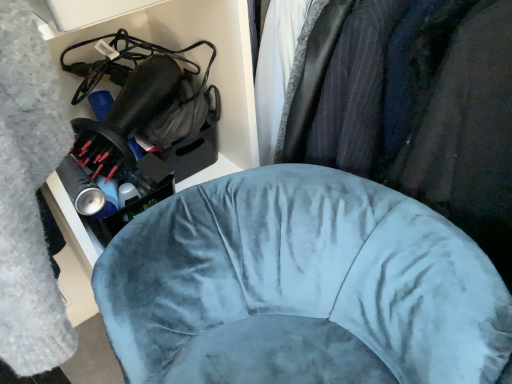
At what (x,y) coordinates should I click in order to perform the action: click on velvet blue chair at center. Please return your answer as a coordinate pair (x, y). Looking at the image, I should click on (307, 273).

This screenshot has width=512, height=384. What do you see at coordinates (307, 273) in the screenshot?
I see `velvet blue chair at center` at bounding box center [307, 273].

Find the location of `velvet blue chair at center`. velvet blue chair at center is located at coordinates (413, 106).

This screenshot has height=384, width=512. Describe the element at coordinates (413, 106) in the screenshot. I see `velvet blue chair at center` at that location.

In order to click on velvet blue chair at center in this screenshot , I will do `click(307, 273)`.

Considering the positions of objects velvet blue chair at center and velvet blue chair at center in the image provided, who is more to the right, velvet blue chair at center or velvet blue chair at center?

velvet blue chair at center is more to the right.

Considering the relative positions of velvet blue chair at center and velvet blue chair at center in the image provided, is velvet blue chair at center in front of velvet blue chair at center?

No, it is not.

Is point (135, 298) positioned behind point (447, 77)?

That is True.

From the picture: From the image's perspective, which one is positioned higher, velvet blue chair at center or velvet blue chair at center?

velvet blue chair at center, from the image's perspective.

From a real-world perspective, is velvet blue chair at center under velvet blue chair at center?

Yes, from a real-world perspective, velvet blue chair at center is below velvet blue chair at center.

Which object is thinner, velvet blue chair at center or velvet blue chair at center?

velvet blue chair at center.

Between velvet blue chair at center and velvet blue chair at center, which one has less height?

With less height is velvet blue chair at center.

Between velvet blue chair at center and velvet blue chair at center, which one has larger size?

Bigger between the two is velvet blue chair at center.

Is velvet blue chair at center completely or partially inside velvet blue chair at center?

Actually, velvet blue chair at center is outside velvet blue chair at center.

Would you consider velvet blue chair at center to be distant from velvet blue chair at center?

Actually, velvet blue chair at center and velvet blue chair at center are a little close together.

Is velvet blue chair at center oriented away from velvet blue chair at center?

That's right, velvet blue chair at center is facing away from velvet blue chair at center.

Locate an element on the screen. This screenshot has height=384, width=512. clothing that is in front of the velvet blue chair at center is located at coordinates [413, 106].

Between velvet blue chair at center and velvet blue chair at center, which one appears on the right side from the viewer's perspective?

From the viewer's perspective, velvet blue chair at center appears more on the right side.

In the image, is velvet blue chair at center positioned in front of or behind velvet blue chair at center?

velvet blue chair at center is in front of velvet blue chair at center.

Considering the positions of points (291, 132) and (329, 309), is point (291, 132) farther from camera compared to point (329, 309)?

Yes, point (291, 132) is farther from viewer.

From the picture: From the image's perspective, between velvet blue chair at center and velvet blue chair at center, which one is located above?

From the image's view, velvet blue chair at center is above.

From a real-world perspective, between velvet blue chair at center and velvet blue chair at center, who is vertically higher?

velvet blue chair at center is physically above.

Is velvet blue chair at center wider than velvet blue chair at center?

Correct, the width of velvet blue chair at center exceeds that of velvet blue chair at center.

Between velvet blue chair at center and velvet blue chair at center, which one has less height?

Standing shorter between the two is velvet blue chair at center.

Consider the image. In terms of size, does velvet blue chair at center appear bigger or smaller than velvet blue chair at center?

velvet blue chair at center is bigger than velvet blue chair at center.

Is velvet blue chair at center inside or outside of velvet blue chair at center?

velvet blue chair at center cannot be found inside velvet blue chair at center.

Is velvet blue chair at center next to velvet blue chair at center and touching it?

No, velvet blue chair at center is not next to velvet blue chair at center.

Is velvet blue chair at center at the back of velvet blue chair at center?

No, velvet blue chair at center is not facing the opposite direction of velvet blue chair at center.

What's the angular difference between velvet blue chair at center and velvet blue chair at center's facing directions?

There is a 43.8-degree angle between the facing directions of velvet blue chair at center and velvet blue chair at center.

How far apart are velvet blue chair at center and velvet blue chair at center?

velvet blue chair at center is 6.60 inches away from velvet blue chair at center.

The height and width of the screenshot is (384, 512). In order to click on furniture on the left of velvet blue chair at center in this screenshot , I will do `click(307, 273)`.

Where is `clothing that appears on the right of velvet blue chair at center`? The height and width of the screenshot is (384, 512). clothing that appears on the right of velvet blue chair at center is located at coordinates [413, 106].

Where is `clothing above the velvet blue chair at center (from a real-world perspective)`? Image resolution: width=512 pixels, height=384 pixels. clothing above the velvet blue chair at center (from a real-world perspective) is located at coordinates coord(413,106).